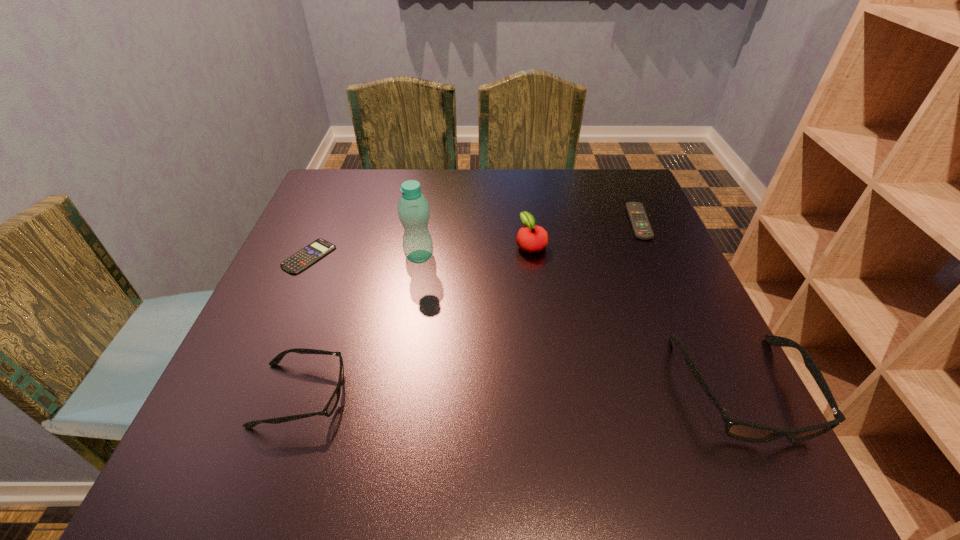
This screenshot has height=540, width=960. Find the location of `the shorter spectacles`. the shorter spectacles is located at coordinates (330, 407).

Where is `the fourth tallest object`? the fourth tallest object is located at coordinates (330, 407).

You are a GUI agent. You are given a task and a screenshot of the screen. Output one action in this format:
    pyautogui.click(x=<x>, y=<y>)
    Task: Click on the taller spectacles
    The height and width of the screenshot is (540, 960).
    Given the screenshot: What is the action you would take?
    pyautogui.click(x=738, y=429)

The height and width of the screenshot is (540, 960). Identify the location of the fifth tallest object. (639, 221).

Where is `the shortest object`? This screenshot has height=540, width=960. the shortest object is located at coordinates (305, 257).

This screenshot has width=960, height=540. In order to click on the fourth object from left to right in this screenshot , I will do `click(531, 238)`.

Identify the location of the tallest object. (413, 209).

Locate an element on the screen. the fourth object from right to left is located at coordinates (413, 209).

Locate an element on the screen. The width and height of the screenshot is (960, 540). vacant region located on the front-facing side of the shorter spectacles is located at coordinates (373, 395).

This screenshot has height=540, width=960. What are the coordinates of `vacant position located 0.100m on the front of the remote control` in the screenshot? It's located at (659, 268).